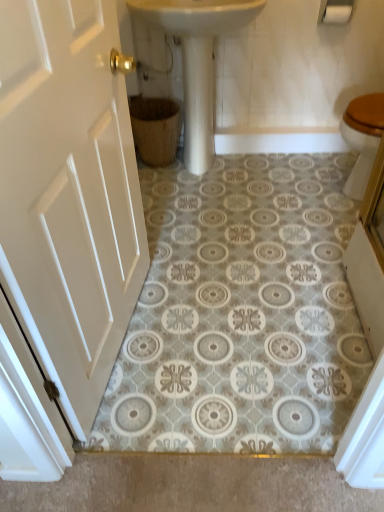
Question: Should I look upward or downward to see white glossy sink at center?

Choices:
 (A) up
 (B) down

Answer: (A)

Question: From the image's perspective, would you say woven brown basket at lower center is positioned over white glossy sink at center?

Choices:
 (A) yes
 (B) no

Answer: (B)

Question: Does woven brown basket at lower center have a lesser height compared to white glossy sink at center?

Choices:
 (A) no
 (B) yes

Answer: (B)

Question: Is woven brown basket at lower center positioned before white glossy sink at center?

Choices:
 (A) no
 (B) yes

Answer: (A)

Question: Considering the relative sizes of woven brown basket at lower center and white glossy sink at center in the image provided, is woven brown basket at lower center smaller than white glossy sink at center?

Choices:
 (A) no
 (B) yes

Answer: (B)

Question: Does woven brown basket at lower center have a lesser width compared to white glossy sink at center?

Choices:
 (A) no
 (B) yes

Answer: (B)

Question: Is woven brown basket at lower center at the right side of white glossy sink at center?

Choices:
 (A) no
 (B) yes

Answer: (A)

Question: Could you tell me if white painted wood door at left is facing white matte toilet paper at upper right?

Choices:
 (A) yes
 (B) no

Answer: (B)

Question: Does white painted wood door at left have a smaller size compared to white matte toilet paper at upper right?

Choices:
 (A) no
 (B) yes

Answer: (A)

Question: Is white painted wood door at left not near white matte toilet paper at upper right?

Choices:
 (A) no
 (B) yes

Answer: (B)

Question: Does white painted wood door at left appear on the right side of white matte toilet paper at upper right?

Choices:
 (A) no
 (B) yes

Answer: (A)

Question: Does white painted wood door at left lie in front of white matte toilet paper at upper right?

Choices:
 (A) no
 (B) yes

Answer: (B)

Question: Can you confirm if white painted wood door at left is taller than white matte toilet paper at upper right?

Choices:
 (A) yes
 (B) no

Answer: (A)

Question: Does woven brown basket at lower center turn towards white painted wood door at left?

Choices:
 (A) yes
 (B) no

Answer: (A)